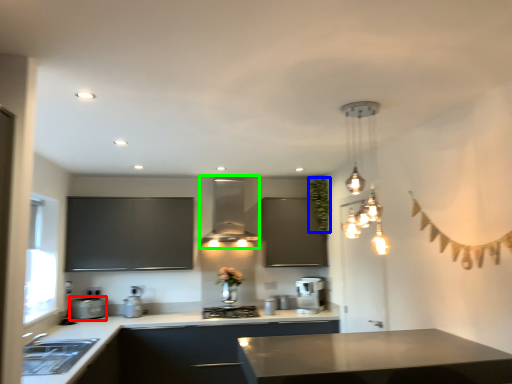
Question: Which object is the farthest from appliance (highlighted by a red box)? Choose among these: plant (highlighted by a blue box) or exhaust hood (highlighted by a green box).

Choices:
 (A) plant
 (B) exhaust hood

Answer: (A)